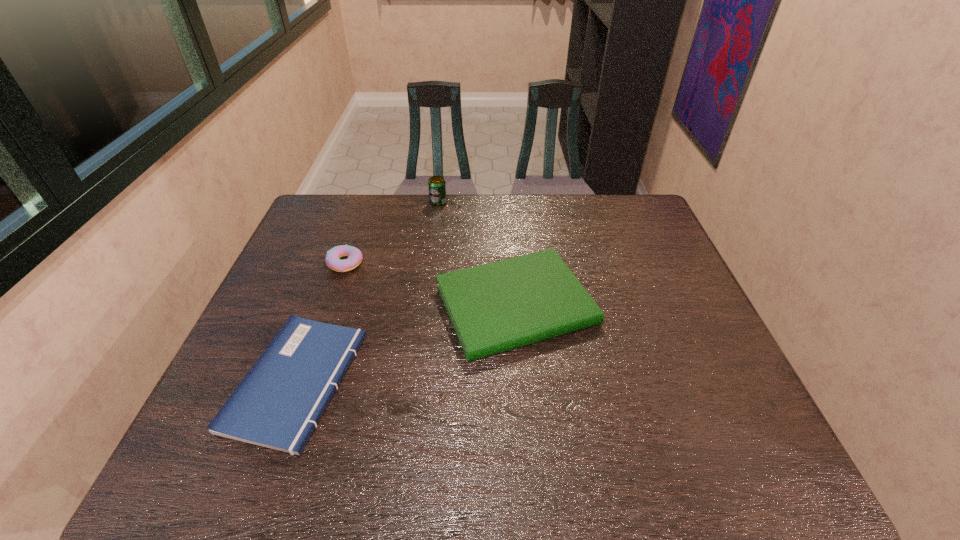
At what (x,y) coordinates should I click in order to perform the action: click on free space between the taller paperback book and the shortest object. Please return your answer as a coordinate pair (x, y). This screenshot has height=540, width=960. Looking at the image, I should click on (406, 343).

Image resolution: width=960 pixels, height=540 pixels. In order to click on vacant space that is in between the taller paperback book and the doughnut in this screenshot , I will do `click(431, 284)`.

What are the coordinates of `the closest object to the taller paperback book` in the screenshot? It's located at [x=278, y=404].

Locate which object is the third closest to the shortest object. Please provide its 2D coordinates. Your answer should be formatted as a tuple, i.e. [(x, y)], where the tuple contains the x and y coordinates of a point satisfying the conditions above.

[(436, 185)]

Locate an element on the screen. The image size is (960, 540). free region that satisfies the following two spatial constraints: 1. on the back side of the doughnut; 2. on the right side of the beer can is located at coordinates (367, 202).

Locate an element on the screen. The image size is (960, 540). vacant space that satisfies the following two spatial constraints: 1. on the front side of the taller paperback book; 2. on the left side of the beer can is located at coordinates (424, 305).

At what (x,y) coordinates should I click in order to perform the action: click on vacant space that satisfies the following two spatial constraints: 1. on the back side of the taller paperback book; 2. on the right side of the shorter paperback book. Please return your answer as a coordinate pair (x, y). Image resolution: width=960 pixels, height=540 pixels. Looking at the image, I should click on (324, 305).